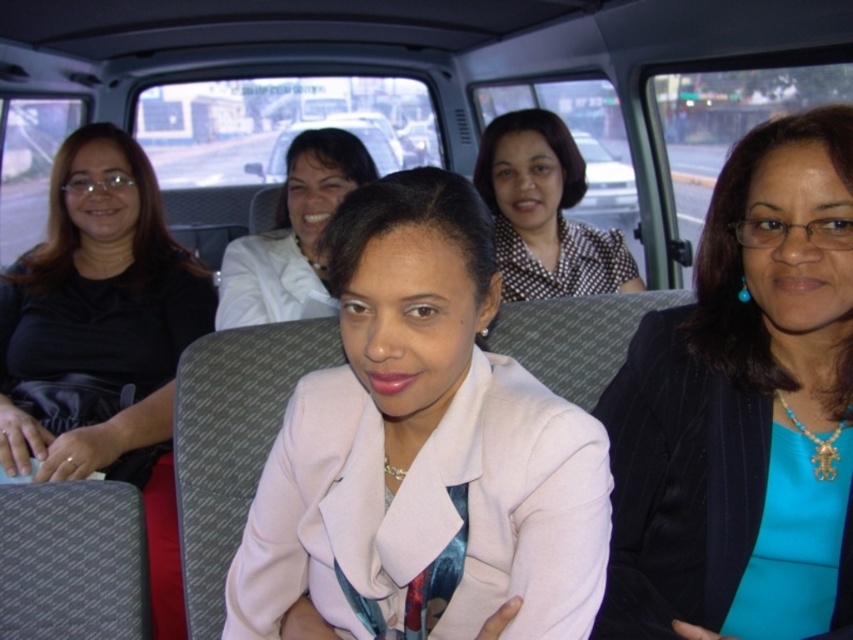
Between matte black blazer at right and black matte dress at left, which one has more height?

With more height is black matte dress at left.

Locate an element on the screen. This screenshot has width=853, height=640. matte black blazer at right is located at coordinates (744, 410).

You are a GUI agent. You are given a task and a screenshot of the screen. Output one action in this format:
    pyautogui.click(x=<x>, y=<y>)
    Task: Click on the matte black blazer at right
    The image size is (853, 640).
    Given the screenshot: What is the action you would take?
    pyautogui.click(x=744, y=410)

Does polka dot blouse at center appear on the left side of matte white car at center?

Incorrect, polka dot blouse at center is not on the left side of matte white car at center.

Is polka dot blouse at center smaller than matte white car at center?

Yes.

Between point (521, 228) and point (265, 170), which one is positioned in front?

Point (521, 228)

This screenshot has width=853, height=640. What are the coordinates of `polka dot blouse at center` in the screenshot? It's located at (544, 212).

Who is positioned more to the right, matte black blazer at right or polka dot blouse at center?

Positioned to the right is matte black blazer at right.

Can you confirm if matte black blazer at right is smaller than polka dot blouse at center?

Yes, matte black blazer at right is smaller than polka dot blouse at center.

Between point (821, 172) and point (578, 259), which one is positioned in front?

Point (821, 172) is more forward.

The height and width of the screenshot is (640, 853). In order to click on matte black blazer at right in this screenshot , I will do `click(744, 410)`.